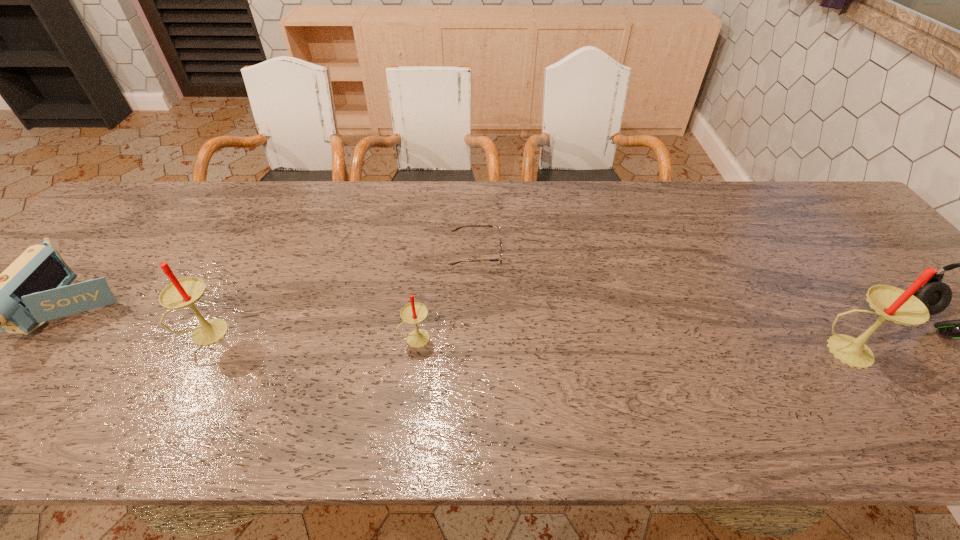
Where is `the fifth shortest object`? the fifth shortest object is located at coordinates (184, 292).

What are the coordinates of `the second tallest candle` in the screenshot? It's located at (184, 292).

Locate an element on the screen. the second candle from right to left is located at coordinates (414, 312).

Identify the location of the shortest candle. The width and height of the screenshot is (960, 540). (414, 312).

The width and height of the screenshot is (960, 540). Find the location of `the rightmost candle`. the rightmost candle is located at coordinates (891, 303).

At what (x,y) coordinates should I click in order to perform the action: click on the farthest object. Please return your answer as a coordinate pair (x, y). Image resolution: width=960 pixels, height=540 pixels. Looking at the image, I should click on (500, 245).

Locate an element on the screen. the third object from right to left is located at coordinates (500, 245).

Where is `free space located 0.150m on the right of the second tallest object`? Image resolution: width=960 pixels, height=540 pixels. free space located 0.150m on the right of the second tallest object is located at coordinates (295, 333).

Image resolution: width=960 pixels, height=540 pixels. Identify the location of vacant space located 0.080m on the right of the third object from left to right. (467, 339).

Where is `free space located on the back of the rightmost candle`? free space located on the back of the rightmost candle is located at coordinates (761, 229).